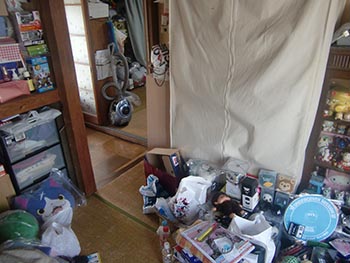
You are a GUI agent. You are given a task and a screenshot of the screen. Output one action in this format:
    pyautogui.click(x=<x>, y=<y>)
    Task: Click on the boxes
    
    Given the screenshot: What is the action you would take?
    pyautogui.click(x=281, y=180), pyautogui.click(x=282, y=196), pyautogui.click(x=274, y=197), pyautogui.click(x=270, y=184), pyautogui.click(x=259, y=193), pyautogui.click(x=235, y=180)